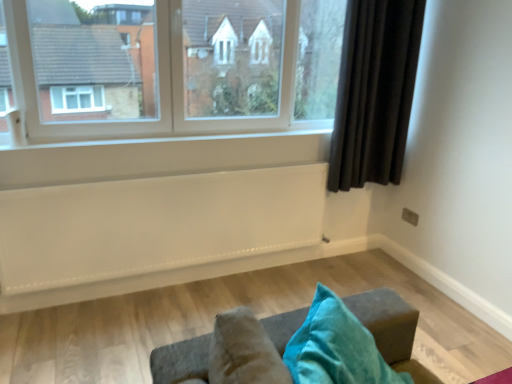
Question: Considering the relative sizes of white textured radiator at lower center and white painted wood at center in the image provided, is white textured radiator at lower center thinner than white painted wood at center?

Choices:
 (A) no
 (B) yes

Answer: (B)

Question: Is the position of white textured radiator at lower center more distant than that of white painted wood at center?

Choices:
 (A) yes
 (B) no

Answer: (B)

Question: Is white textured radiator at lower center at the right side of white painted wood at center?

Choices:
 (A) no
 (B) yes

Answer: (A)

Question: Is white textured radiator at lower center bigger than white painted wood at center?

Choices:
 (A) no
 (B) yes

Answer: (B)

Question: Is white textured radiator at lower center facing away from white painted wood at center?

Choices:
 (A) yes
 (B) no

Answer: (B)

Question: Can you confirm if white textured radiator at lower center is positioned to the left of white painted wood at center?

Choices:
 (A) yes
 (B) no

Answer: (A)

Question: Is clear glass window at upper center positioned beyond the bounds of white painted wood at center?

Choices:
 (A) no
 (B) yes

Answer: (B)

Question: Does clear glass window at upper center have a lesser height compared to white painted wood at center?

Choices:
 (A) no
 (B) yes

Answer: (A)

Question: Can you confirm if clear glass window at upper center is bigger than white painted wood at center?

Choices:
 (A) yes
 (B) no

Answer: (A)

Question: From a real-world perspective, is clear glass window at upper center below white painted wood at center?

Choices:
 (A) no
 (B) yes

Answer: (A)

Question: From the image's perspective, is clear glass window at upper center under white painted wood at center?

Choices:
 (A) yes
 (B) no

Answer: (B)

Question: Is white painted wood at center located within clear glass window at upper center?

Choices:
 (A) yes
 (B) no

Answer: (B)

Question: Can you confirm if white painted wood at center is bigger than dark fabric curtain at right?

Choices:
 (A) no
 (B) yes

Answer: (A)